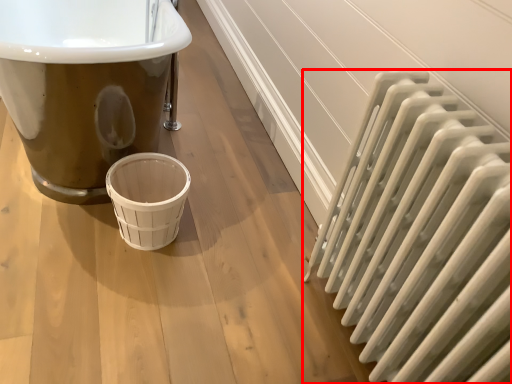
Question: In this image, where is radiator (annotated by the red box) located relative to basket?

Choices:
 (A) left
 (B) right

Answer: (B)